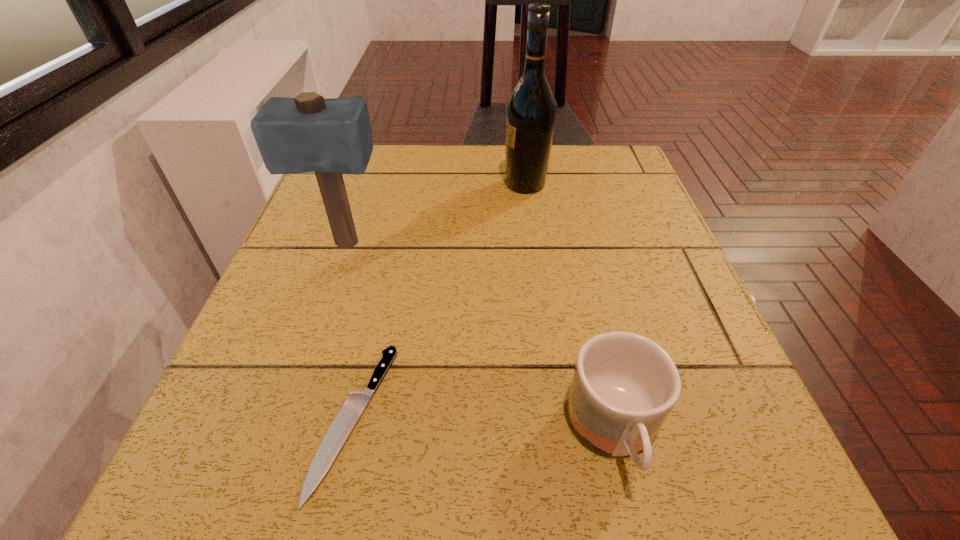
Locate an element on the screen. The height and width of the screenshot is (540, 960). free space located on the right of the shortest object is located at coordinates (481, 419).

Find the location of a particular element. This screenshot has width=960, height=540. object that is at the far edge is located at coordinates [531, 109].

You are a GUI agent. You are given a task and a screenshot of the screen. Output one action in this format:
    pyautogui.click(x=<x>, y=<y>)
    Task: Click on the mug at the near edge
    Image resolution: width=960 pixels, height=540 pixels.
    Given the screenshot: What is the action you would take?
    pyautogui.click(x=624, y=386)

Where is `steak knife located at the near edge`? The image size is (960, 540). steak knife located at the near edge is located at coordinates (344, 422).

This screenshot has height=540, width=960. I want to click on object that is at the left edge, so (308, 133).

At what (x,y) coordinates should I click in order to perform the action: click on object at the right edge. Please return your answer as a coordinate pair (x, y). This screenshot has height=540, width=960. Looking at the image, I should click on (624, 386).

Find the location of a particular element. object located in the near right corner section of the desktop is located at coordinates (624, 386).

In the image, there is a desktop. Identify the location of vacant space at the far edge. The width and height of the screenshot is (960, 540). (432, 162).

In the image, there is a desktop. Where is `vacant space at the near edge`? This screenshot has height=540, width=960. vacant space at the near edge is located at coordinates (408, 465).

At what (x,y) coordinates should I click in order to perform the action: click on free space at the left edge. Please return your answer as a coordinate pair (x, y). The image size is (960, 540). Looking at the image, I should click on (351, 206).